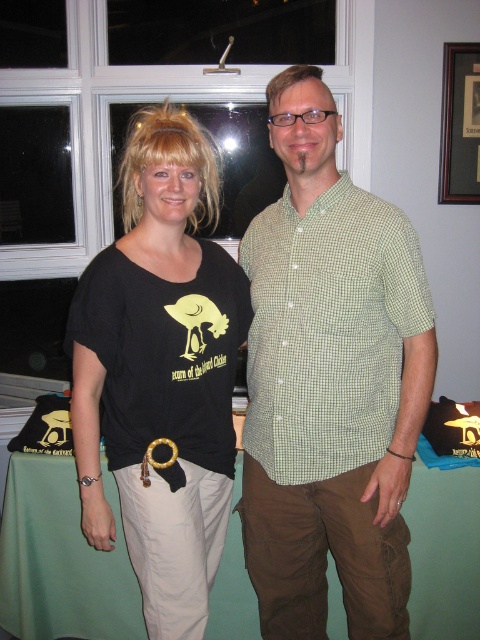
Question: Which point appears farthest from the camera in this image?

Choices:
 (A) (169, 200)
 (B) (14, 550)
 (C) (422, 358)

Answer: (B)

Question: Estimate the real-world distances between objects in this image. Which object is farther from the black matte t-shirt at center?

Choices:
 (A) green checkered shirt at center
 (B) green fabric tablecloth at lower center

Answer: (B)

Question: Which point is closer to the camera taking this photo?

Choices:
 (A) (128, 536)
 (B) (277, 531)
 (C) (448, 621)

Answer: (A)

Question: Does green checkered shirt at center appear over green fabric tablecloth at lower center?

Choices:
 (A) no
 (B) yes

Answer: (B)

Question: Is green checkered shirt at center positioned before green fabric tablecloth at lower center?

Choices:
 (A) no
 (B) yes

Answer: (B)

Question: Is green checkered shirt at center below black matte t-shirt at center?

Choices:
 (A) no
 (B) yes

Answer: (B)